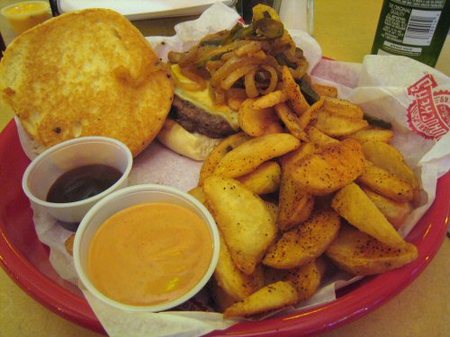
The image size is (450, 337). Find the location of `red plate`. red plate is located at coordinates (73, 297).